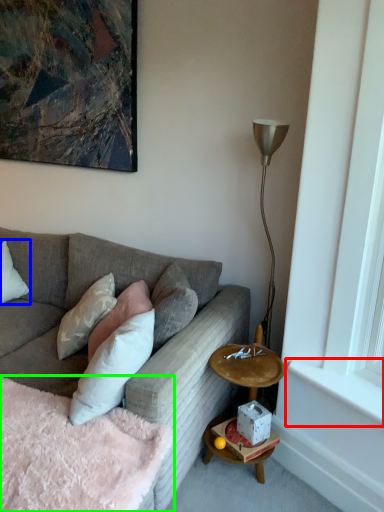
Question: Considering the real-world distances, which object is closest to window sill (highlighted by a red box)? pillow (highlighted by a blue box) or bedding (highlighted by a green box).

Choices:
 (A) pillow
 (B) bedding

Answer: (B)